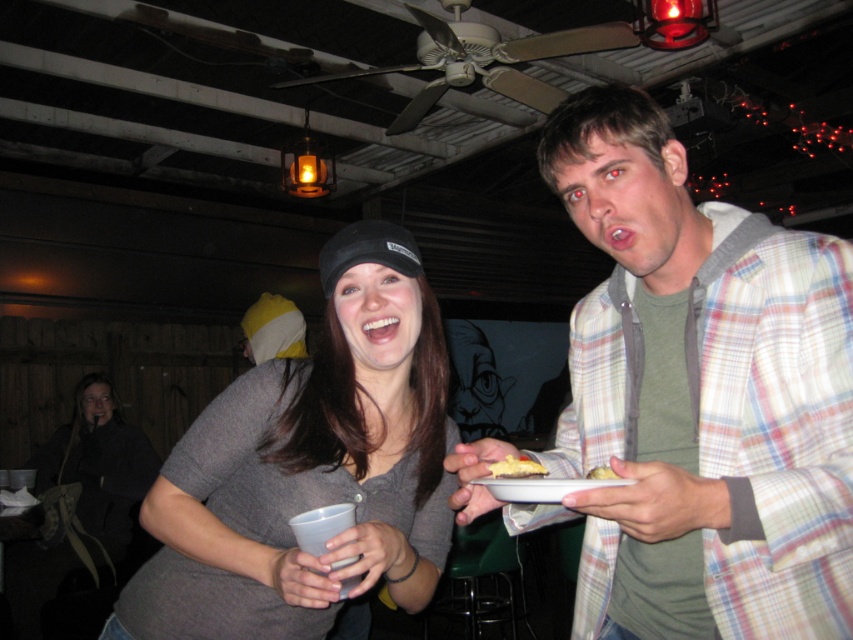
Question: Which point appears closest to the camera in this image?

Choices:
 (A) (718, 227)
 (B) (599, 470)
 (C) (219, 502)

Answer: (B)

Question: Can you confirm if yellow creamy cake at center is smaller than yellow cake at center?

Choices:
 (A) no
 (B) yes

Answer: (A)

Question: Is the position of yellow creamy cake at center more distant than that of yellow cake at center?

Choices:
 (A) yes
 (B) no

Answer: (A)

Question: Can you confirm if plaid shirt at upper right is positioned to the right of yellow cake at center?

Choices:
 (A) no
 (B) yes

Answer: (B)

Question: Estimate the real-world distances between objects in this image. Which object is farther from the yellow creamy cake at center?

Choices:
 (A) matte gray shirt at center
 (B) plaid shirt at upper right

Answer: (A)

Question: Which point is farther from the camera taking this photo?

Choices:
 (A) (589, 474)
 (B) (503, 472)

Answer: (A)